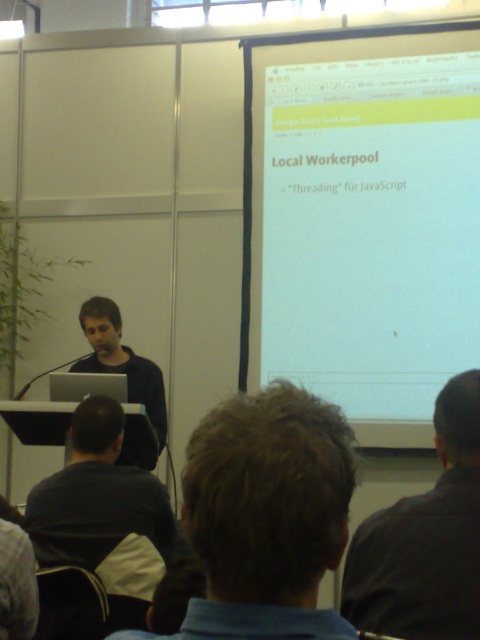
Based on the photo, you are standing in the presentation room and want to move to the point at coordinates (272,51). The room has a 1.8 meter wide door on the left side. Can you walk directly to that point without passing through any obstacles?

The point at coordinates (272,51) is 4.36 meters away from you. Since the room has a 1.8 meter wide door on the left side, and assuming there are no obstacles blocking your path, you can walk directly to the point as long as the distance and door width allow passage. However, without specific information about intervening obstacles, we can only confirm the distance and door width are compatible.

You are an attendee at the presentation and want to take a photo of the slide on the white matte projector screen at upper center and the matte black laptop at center. Which object should you focus on first if you want to capture both in one shot without moving your camera?

The white matte projector screen at upper center should be focused on first because it has a larger size compared to the matte black laptop at center, making it more prominent in the frame.